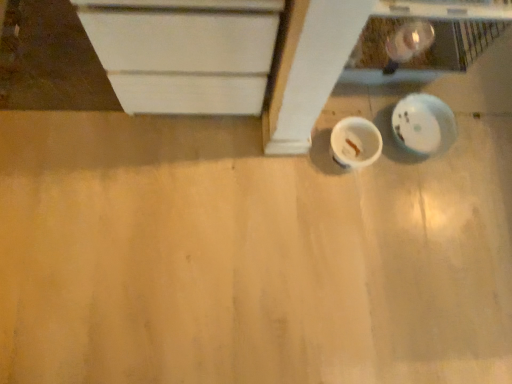
Locate an element on the screen. free space to the left of white matte cup at center is located at coordinates (x=298, y=155).